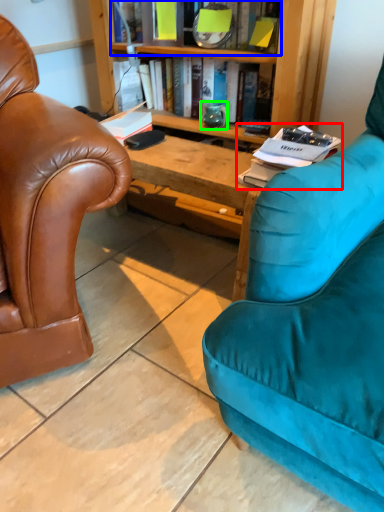
Question: Which is nearer to the book (highlighted by a red box)? book (highlighted by a blue box) or teal (highlighted by a green box).

Choices:
 (A) book
 (B) teal

Answer: (A)